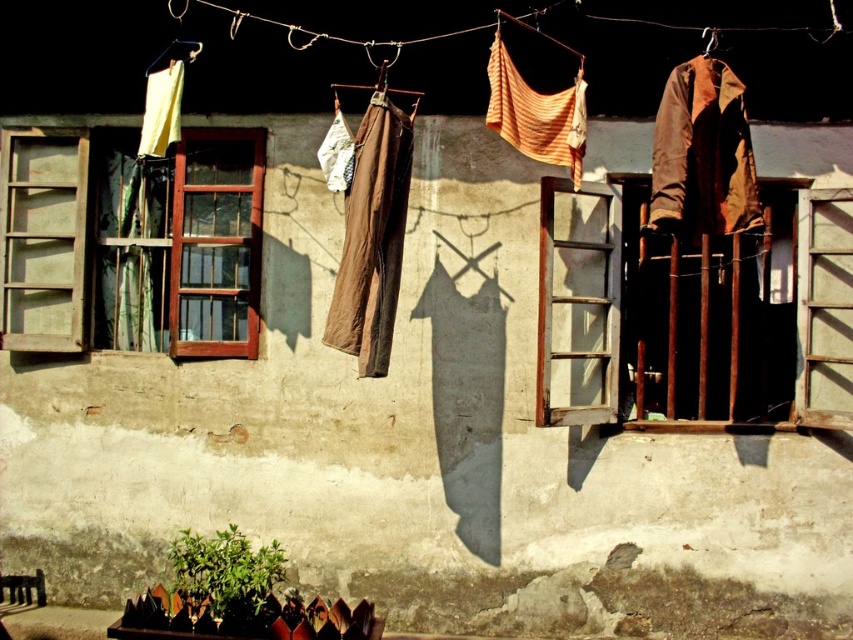
Question: Is brown leather jacket at right thinner than striped cotton cloth at center?

Choices:
 (A) no
 (B) yes

Answer: (A)

Question: Which object is farther from the camera taking this photo?

Choices:
 (A) striped cotton cloth at center
 (B) brown wooden window at left

Answer: (B)

Question: Does brown cotton pants at center have a greater width compared to brown fabric at upper right?

Choices:
 (A) no
 (B) yes

Answer: (B)

Question: Which object appears closest to the camera in this image?

Choices:
 (A) brown cotton pants at center
 (B) brown wooden window at left

Answer: (A)

Question: Does brown leather jacket at right have a greater width compared to striped cotton cloth at center?

Choices:
 (A) yes
 (B) no

Answer: (A)

Question: Which point is farther to the camera?

Choices:
 (A) (96, 292)
 (B) (711, 52)

Answer: (A)